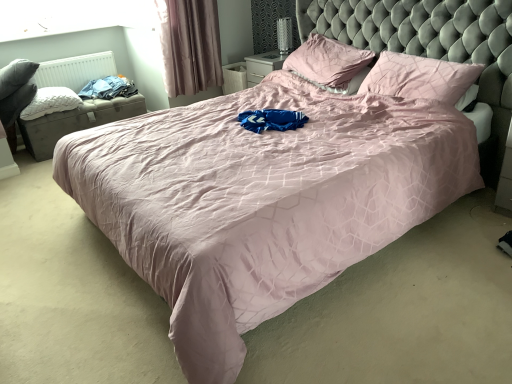
In order to click on free space above white matte radiator at upper left (from a real-world perspective) in this screenshot , I will do `click(66, 57)`.